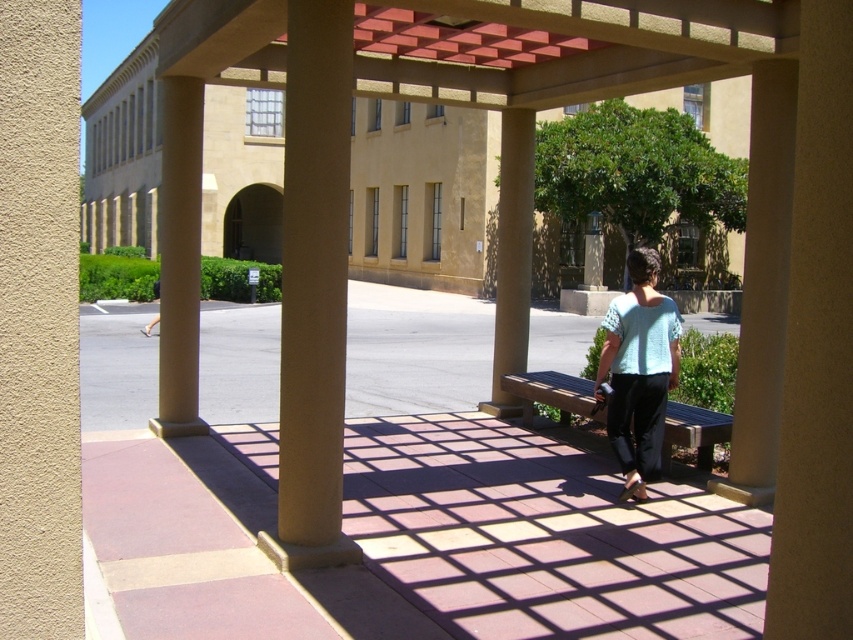
Does beige polished stone column at center come in front of light blue knitted sweater at center-right?

No, it is not.

Does beige polished stone column at center have a lesser width compared to light blue knitted sweater at center-right?

No.

Identify the location of beige polished stone column at center. (178, 259).

The height and width of the screenshot is (640, 853). Find the location of `light blue knitted sweater at center-right`. light blue knitted sweater at center-right is located at coordinates (639, 371).

Who is more distant from viewer, [637,396] or [709,429]?

Point [709,429]

Who is more distant from viewer, (x=645, y=326) or (x=552, y=394)?

The point (x=552, y=394) is more distant.

Where is `light blue knitted sweater at center-right`? light blue knitted sweater at center-right is located at coordinates (639, 371).

Between beige concrete column at center and beige concrete pillar at center, which one is positioned higher?

beige concrete pillar at center is higher up.

Looking at this image, does beige concrete column at center have a greater width compared to beige concrete pillar at center?

Incorrect, beige concrete column at center's width does not surpass beige concrete pillar at center's.

Find the location of `beige concrete column at center`. beige concrete column at center is located at coordinates (312, 288).